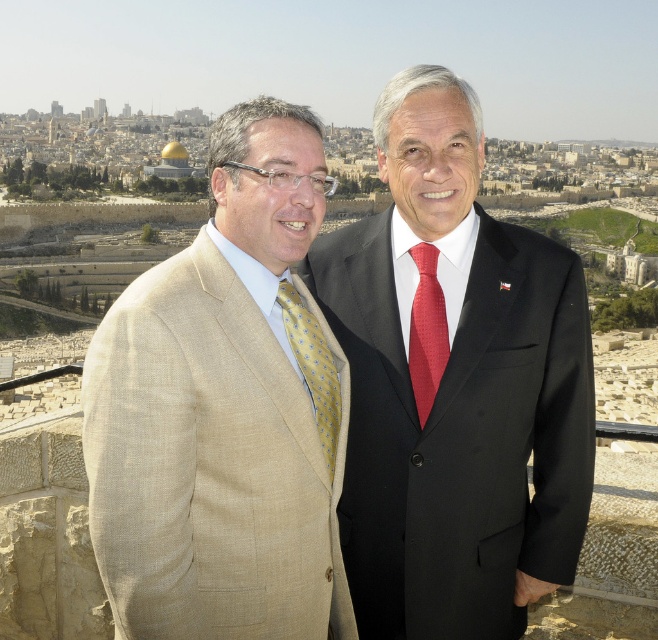
Question: Can you confirm if beige linen suit at left is positioned to the right of red textured tie at center?

Choices:
 (A) yes
 (B) no

Answer: (B)

Question: Among these points, which one is nearest to the camera?

Choices:
 (A) (122, 516)
 (B) (494, 518)
 (C) (324, 364)
 (D) (384, 433)

Answer: (A)

Question: Is beige textured suit at center to the right of beige linen suit at left from the viewer's perspective?

Choices:
 (A) yes
 (B) no

Answer: (A)

Question: Does beige linen suit at left come behind red textured tie at center?

Choices:
 (A) yes
 (B) no

Answer: (B)

Question: Estimate the real-world distances between objects in this image. Which object is closer to the black wool suit at center?

Choices:
 (A) beige linen suit at left
 (B) beige textured suit at center

Answer: (B)

Question: Which point appears closest to the camera in this image?

Choices:
 (A) (386, 609)
 (B) (343, 561)

Answer: (A)